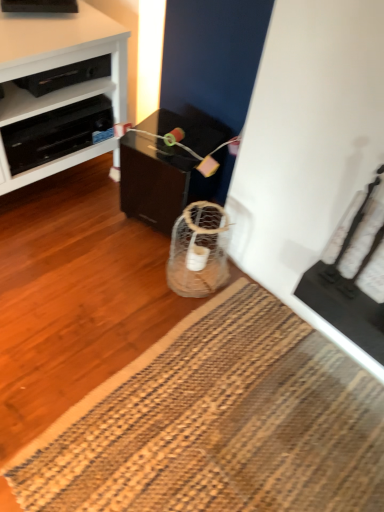
This screenshot has height=512, width=384. Find the location of `free spot above natural fiber mat at lower center (from a real-world perspective)`. free spot above natural fiber mat at lower center (from a real-world perspective) is located at coordinates (236, 422).